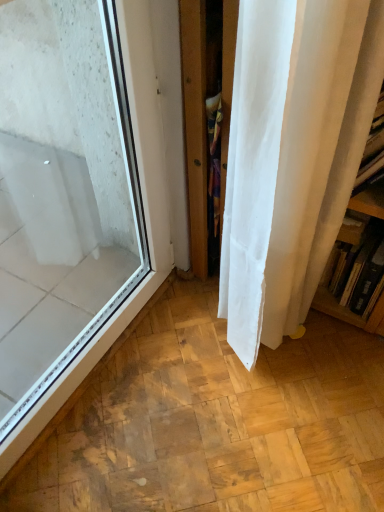
Question: Is point (21, 258) closer or farther from the camera than point (365, 194)?

Choices:
 (A) farther
 (B) closer

Answer: (A)

Question: Relative to wooden bookshelf at right, is transparent glass window at left in front or behind?

Choices:
 (A) behind
 (B) front

Answer: (B)

Question: From a real-world perspective, is transparent glass window at left physically located above or below wooden bookshelf at right?

Choices:
 (A) above
 (B) below

Answer: (A)

Question: Is wooden bookshelf at right wider or thinner than transparent glass window at left?

Choices:
 (A) thin
 (B) wide

Answer: (B)

Question: Considering the positions of point (334, 250) and point (89, 20), is point (334, 250) closer or farther from the camera than point (89, 20)?

Choices:
 (A) farther
 (B) closer

Answer: (A)

Question: Is wooden bookshelf at right in front of or behind transparent glass window at left in the image?

Choices:
 (A) behind
 (B) front

Answer: (A)

Question: Is wooden bookshelf at right to the left or to the right of transparent glass window at left in the image?

Choices:
 (A) right
 (B) left

Answer: (A)